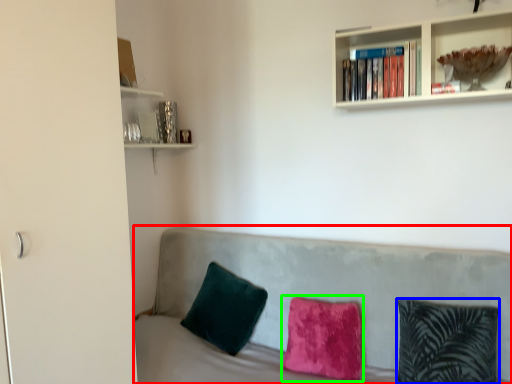
Question: Which object is the farthest from studio couch (highlighted by a red box)? Choose among these: pillow (highlighted by a blue box) or pillow (highlighted by a green box).

Choices:
 (A) pillow
 (B) pillow

Answer: (A)